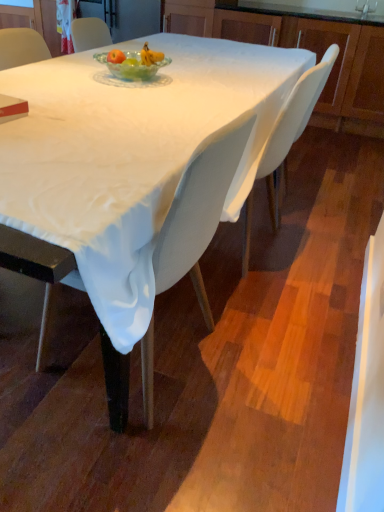
The width and height of the screenshot is (384, 512). I want to click on free spot to the left of translucent glass bowl at center, so click(68, 72).